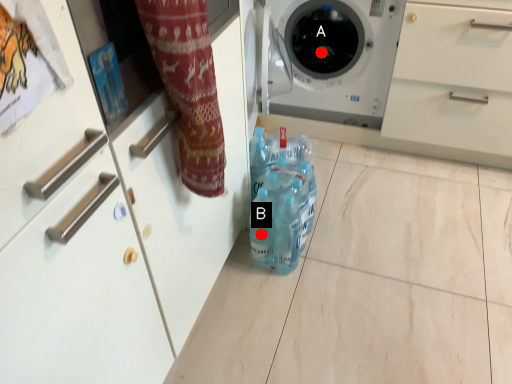
Question: Two points are circled on the image, labeled by A and B beside each circle. Among these points, which one is nearest to the camera?

Choices:
 (A) A is closer
 (B) B is closer

Answer: (B)